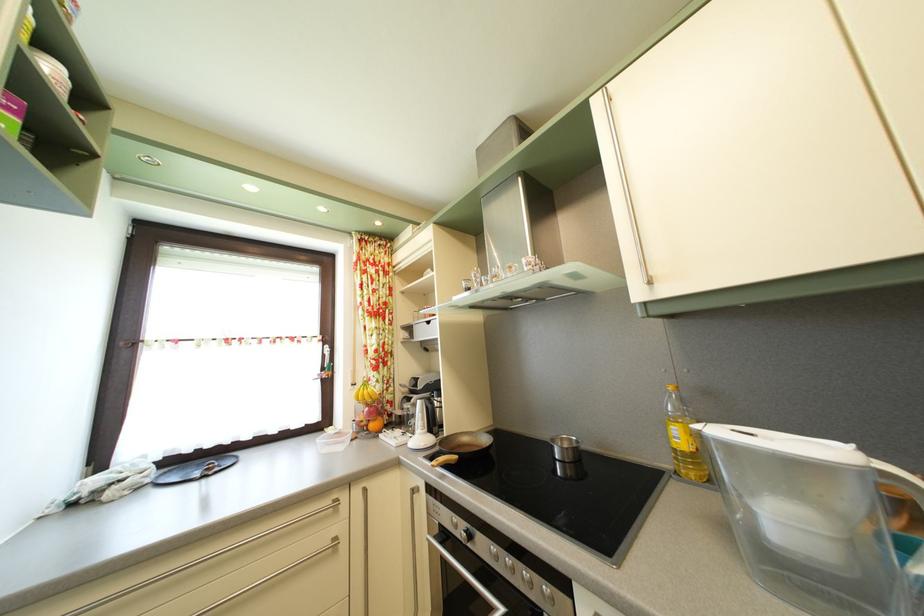
Find the location of `window handle`. window handle is located at coordinates (128, 346).